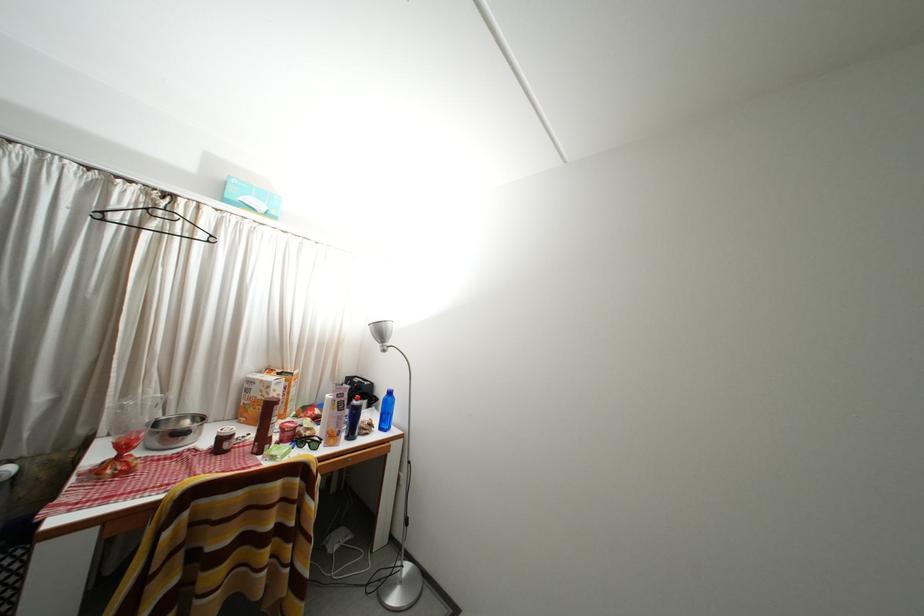
This screenshot has height=616, width=924. What are the coordinates of `chair sitting surface` in the screenshot? It's located at (119, 549).